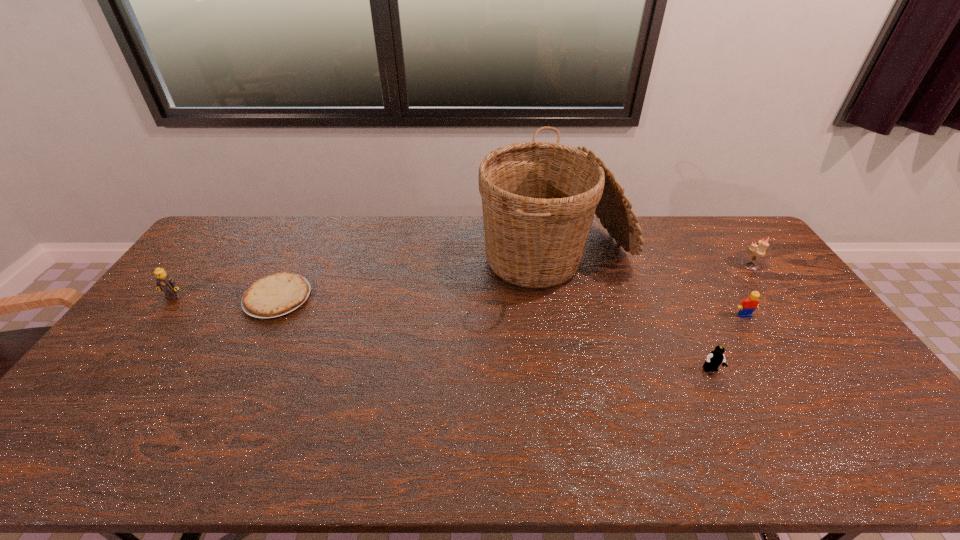
The image size is (960, 540). What are the coordinates of `vacant region at the far edge of the desktop` in the screenshot? It's located at (439, 240).

Identify the location of free location at the near edge of the desktop. This screenshot has width=960, height=540. (412, 451).

The width and height of the screenshot is (960, 540). In order to click on vacant space at the left edge of the desktop in this screenshot , I will do `click(151, 312)`.

The image size is (960, 540). Find the location of `vacant area at the right edge of the desktop`. vacant area at the right edge of the desktop is located at coordinates (747, 280).

The height and width of the screenshot is (540, 960). What are the coordinates of `free region at the far left corner` in the screenshot? It's located at (227, 223).

Where is `blank space at the near right corner`? This screenshot has height=540, width=960. blank space at the near right corner is located at coordinates (925, 461).

The width and height of the screenshot is (960, 540). What are the coordinates of `vacant region between the basket and the shortest object` in the screenshot? It's located at (417, 279).

Locate an element on the screen. This screenshot has height=540, width=960. vacant area that lies between the fifth object from right to left and the nearest object is located at coordinates (494, 334).

At what (x,y) coordinates should I click in order to perform the action: click on empty location between the tallest object and the second farthest Lego. Please return your answer as a coordinate pair (x, y). This screenshot has height=540, width=960. Looking at the image, I should click on (650, 288).

Image resolution: width=960 pixels, height=540 pixels. Find the location of `unoccupied position between the rightmost object and the nearest Lego`. unoccupied position between the rightmost object and the nearest Lego is located at coordinates (731, 318).